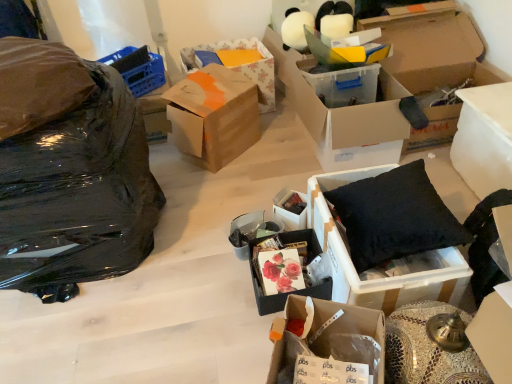
Locate an element on the screen. Image resolution: width=512 pixels, height=384 pixels. vacant area located to the right-hand side of black plastic bag at left is located at coordinates (205, 239).